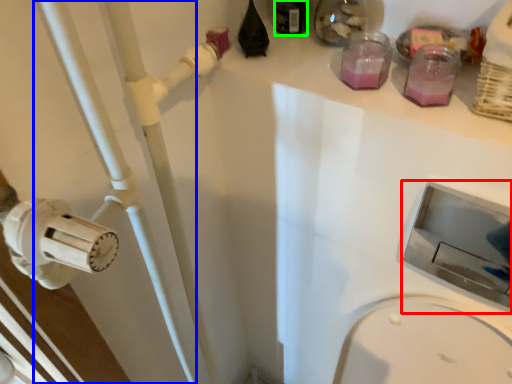
Question: Based on their relative distances, which object is nearer to sink (highlighted by a red box)? Choose from pipe (highlighted by a blue box) and bottle (highlighted by a green box).

Choices:
 (A) pipe
 (B) bottle

Answer: (A)